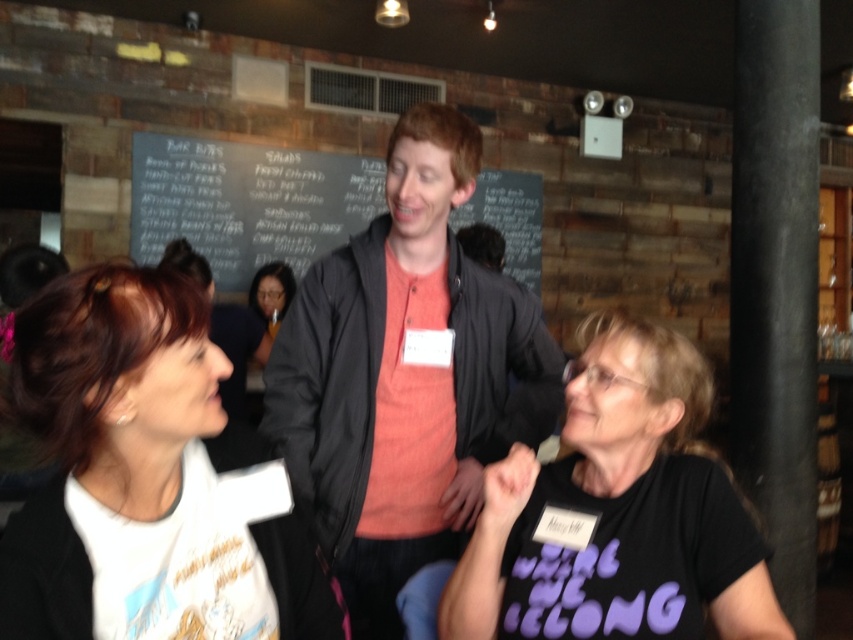
Question: Which point is farther to the camera?

Choices:
 (A) matte black hair at center
 (B) black smooth pole at right

Answer: (A)

Question: Where is white matte t-shirt at upper left located in relation to chalkboard at center in the image?

Choices:
 (A) right
 (B) left

Answer: (A)

Question: Does black matte t-shirt at lower right appear under black smooth pole at right?

Choices:
 (A) no
 (B) yes

Answer: (B)

Question: Which object appears farthest from the camera in this image?

Choices:
 (A) white matte t-shirt at upper left
 (B) black matte t-shirt at lower right

Answer: (B)

Question: Among these points, which one is nearest to the camera?

Choices:
 (A) (756, 141)
 (B) (16, 387)
 (C) (332, 442)

Answer: (B)

Question: Does black matte t-shirt at lower right appear over matte black hair at center?

Choices:
 (A) no
 (B) yes

Answer: (A)